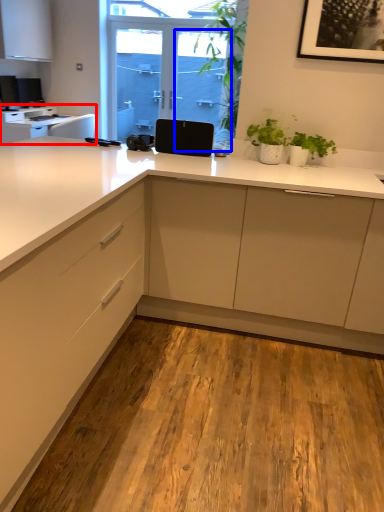
Question: Which point is closer to the camera, countertop (highlighted by a red box) or screen door (highlighted by a blue box)?

Choices:
 (A) countertop
 (B) screen door

Answer: (A)